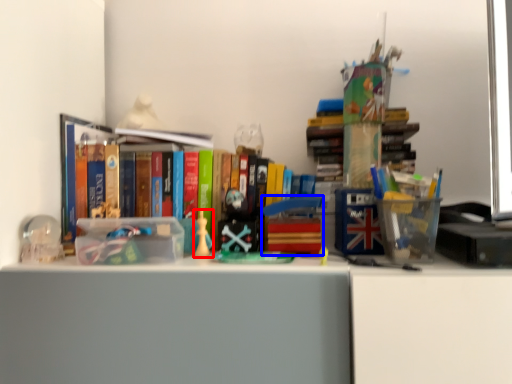
Question: Which of the following is the closest to the observer, toy (highlighted by a red box) or toy (highlighted by a blue box)?

Choices:
 (A) toy
 (B) toy

Answer: (B)